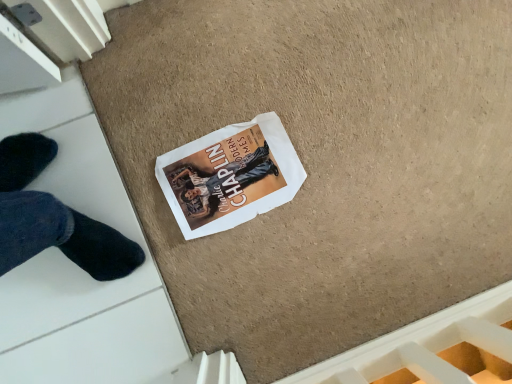
You are a GUI agent. You are given a task and a screenshot of the screen. Output one action in this format:
    pyautogui.click(x=<x>, y=<y>)
    Task: Click on the free space to the back side of white paper magazine at center
    
    Given the screenshot: What is the action you would take?
    pyautogui.click(x=290, y=92)